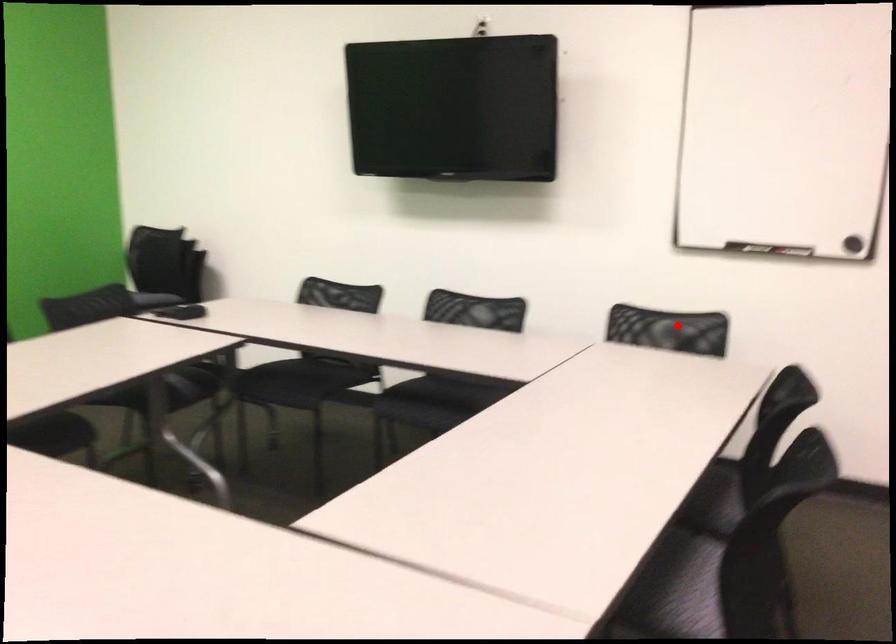
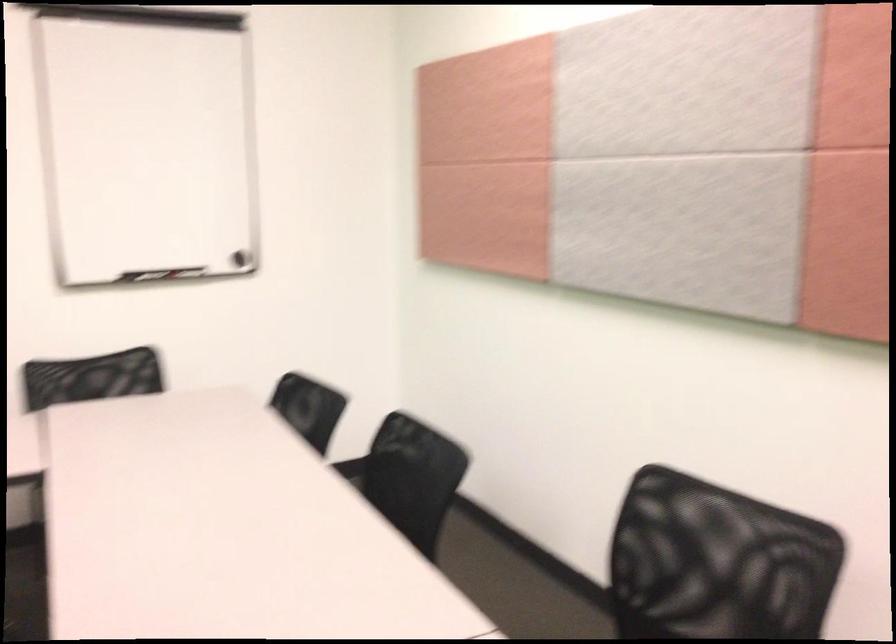
Question: A red point is marked in image1. In image2, is the corresponding 3D point closer to the camera or farther? Reply with the corresponding letter.

Choices:
 (A) The corresponding 3D point is closer.
 (B) The corresponding 3D point is farther.

Answer: (A)